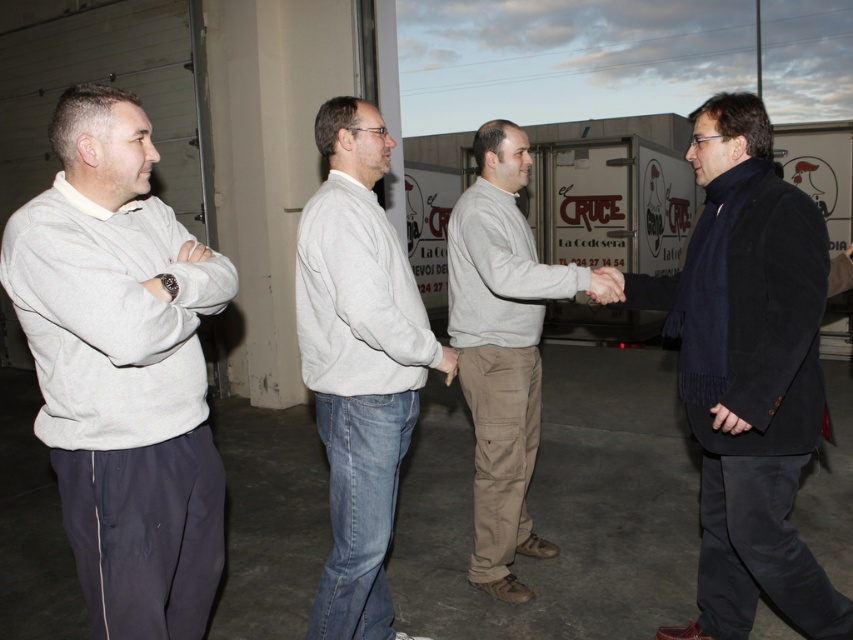
Question: Which of the following is the closest to the observer?

Choices:
 (A) white cardboard trailer truck at center
 (B) khaki cotton pants at center
 (C) light gray sweatshirt at left
 (D) dark blue woolen coat at right

Answer: (C)

Question: Can you confirm if light gray sweatshirt at left is bigger than gray sweatshirt at center?

Choices:
 (A) no
 (B) yes

Answer: (A)

Question: Does gray sweatshirt at center appear on the left side of khaki cotton pants at center?

Choices:
 (A) no
 (B) yes

Answer: (B)

Question: Is light gray sweatshirt at left bigger than gray sweatshirt at center?

Choices:
 (A) no
 (B) yes

Answer: (A)

Question: Estimate the real-world distances between objects in this image. Which object is closer to the gray sweatshirt at center?

Choices:
 (A) dark blue woolen coat at right
 (B) light gray sweatshirt at left
 (C) khaki cotton pants at center

Answer: (B)

Question: Which point is farther from the camera taking this photo?

Choices:
 (A) (158, 305)
 (B) (726, 560)

Answer: (B)